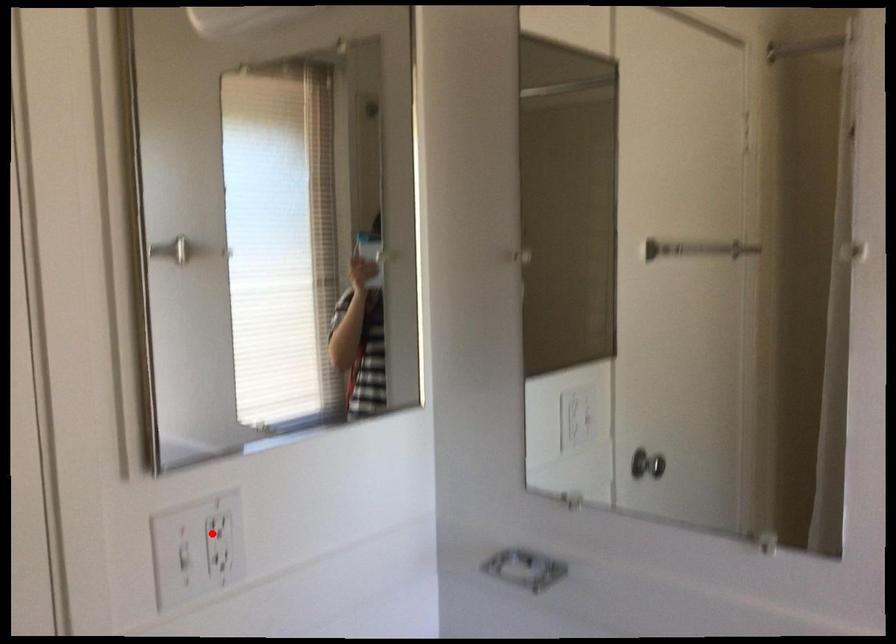
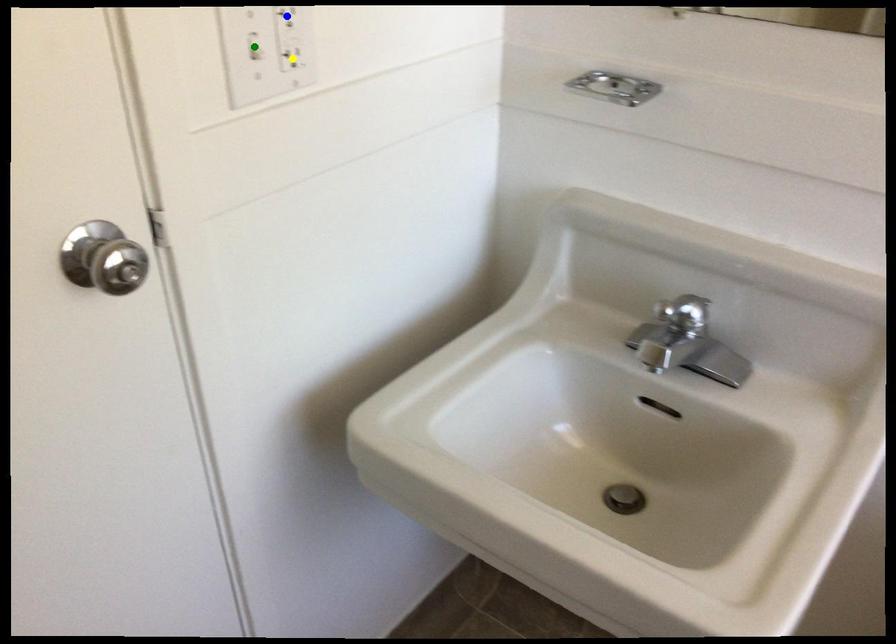
Question: I am providing you with two images of the same scene from different viewpoints. A red point is marked on the first image. You are given multiple points on the second image. Which spot in image 2 lines up with the point in image 1?

Choices:
 (A) green point
 (B) yellow point
 (C) blue point

Answer: (C)